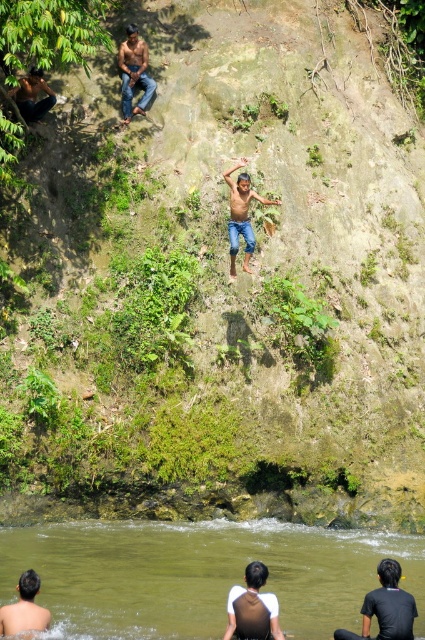
Consider the image. You are a photographer trying to capture a wide shot of the scene. You notice the dark brown hair at lower right and the brown leather jacket at upper left. Based on their sizes in the image, which object would require you to zoom out more to ensure both are fully in frame?

The dark brown hair at lower right is wider than the brown leather jacket at upper left, so you would need to zoom out more to include the wider dark brown hair at lower right in the frame.

You are standing at the point labeled point (362, 611) and want to move to the point labeled point (22, 80). Given the steep cliff and rocky terrain described in the scene, is there a clear path between these two points?

Point (362, 611) is in front of point (22, 80), meaning they are aligned along the same line of sight. However, the steep cliff and rocky terrain described in the scene likely block a clear path between them. You would need to navigate around the obstacles using the vegetation patches or find a safer route along the cliff edge.

Looking at this image, you are a photographer trying to capture the scene of the brown skin child at center and the brown leather jacket at upper left. Which object should you focus on to ensure it appears larger in your photo?

The brown skin child at center should be focused on because it is bigger than the brown leather jacket at upper left.